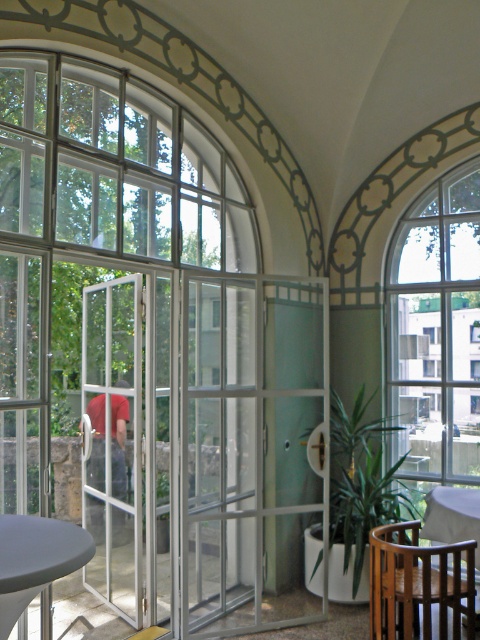
Question: Can you confirm if matte gray table at lower left is positioned below wooden table at lower right?

Choices:
 (A) no
 (B) yes

Answer: (A)

Question: Does clear glass window at right appear on the right side of mahogany wood chair at lower right?

Choices:
 (A) yes
 (B) no

Answer: (A)

Question: Among these objects, which one is nearest to the camera?

Choices:
 (A) mahogany wood chair at lower right
 (B) clear glass window at right
 (C) matte gray table at lower left

Answer: (C)

Question: Which point is farther to the camera?

Choices:
 (A) (360, 468)
 (B) (403, 540)
 (C) (137, 563)
 (D) (9, 579)

Answer: (A)

Question: Which object is farther from the camera taking this photo?

Choices:
 (A) matte gray table at lower left
 (B) green leafy plant at center

Answer: (B)

Question: Is white glass door at center above green leafy plant at center?

Choices:
 (A) no
 (B) yes

Answer: (B)